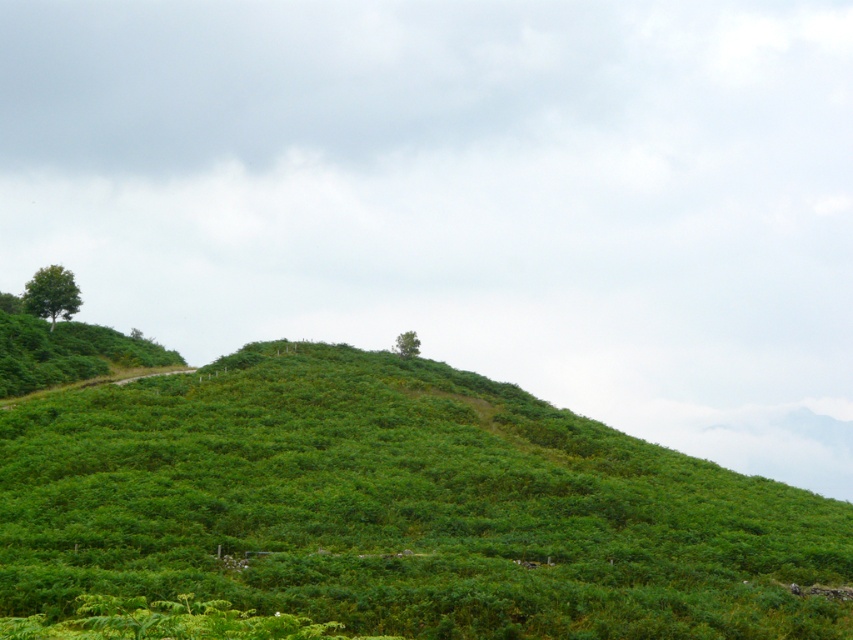
You are a hiker standing on the green leafy hillside at center and want to reach the green leafy tree at upper center. Which direction should you move to get closer to the tree?

The green leafy tree at upper center is located towards the upper part of the slope compared to the green leafy hillside at center. To reach it, you should move upwards along the slope towards the upper center direction.

You are a hiker trying to navigate the green leafy hillside at center and the green leafy tree at upper left. Which direction should you go to reach the tree from the hillside?

To reach the green leafy tree at upper left from the green leafy hillside at center, you should go to the left since the green leafy hillside at center is positioned on the right side of the tree.

You are a hiker trying to navigate through the hillside. You see the green leafy tree at upper left and the green leafy tree at upper center in the distance. Which tree would appear closer to you when looking from the bottom of the hill?

The green leafy tree at upper left is in front of the green leafy tree at upper center, so it would appear closer to you when looking from the bottom of the hill.